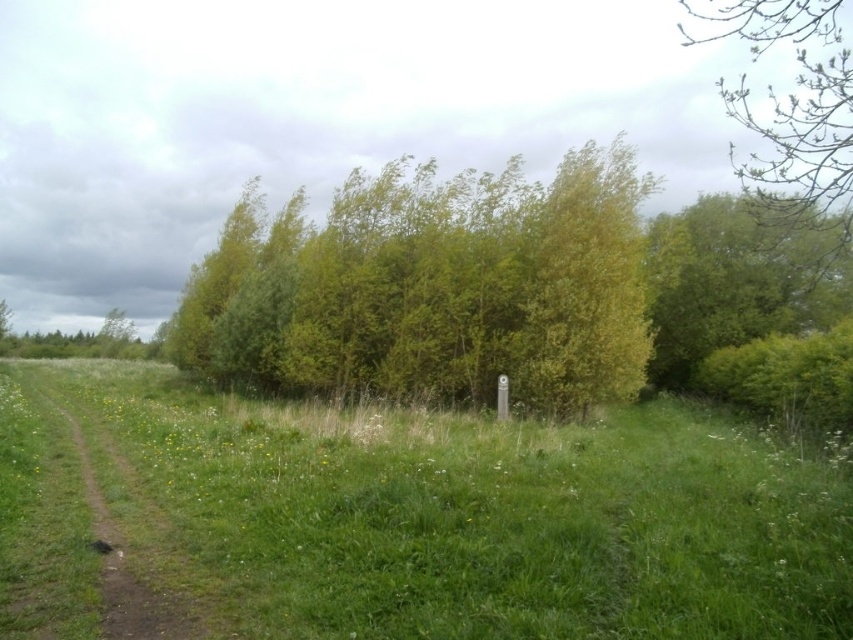
Question: Which object is closer to the camera taking this photo?

Choices:
 (A) green leafy trees at center
 (B) green grassy field at center
 (C) brown dirt track at left

Answer: (B)

Question: Is green grassy field at center to the right of green leafy tree at upper right from the viewer's perspective?

Choices:
 (A) yes
 (B) no

Answer: (B)

Question: Can you confirm if green grassy field at center is wider than green leafy tree at upper right?

Choices:
 (A) yes
 (B) no

Answer: (A)

Question: Is the position of green leafy trees at center less distant than that of brown dirt track at left?

Choices:
 (A) no
 (B) yes

Answer: (A)

Question: Among these points, which one is farthest from the camera?

Choices:
 (A) (146, 420)
 (B) (328, 241)

Answer: (B)

Question: Which is nearer to the green leafy tree at upper right?

Choices:
 (A) green leafy trees at center
 (B) green grassy field at center

Answer: (A)